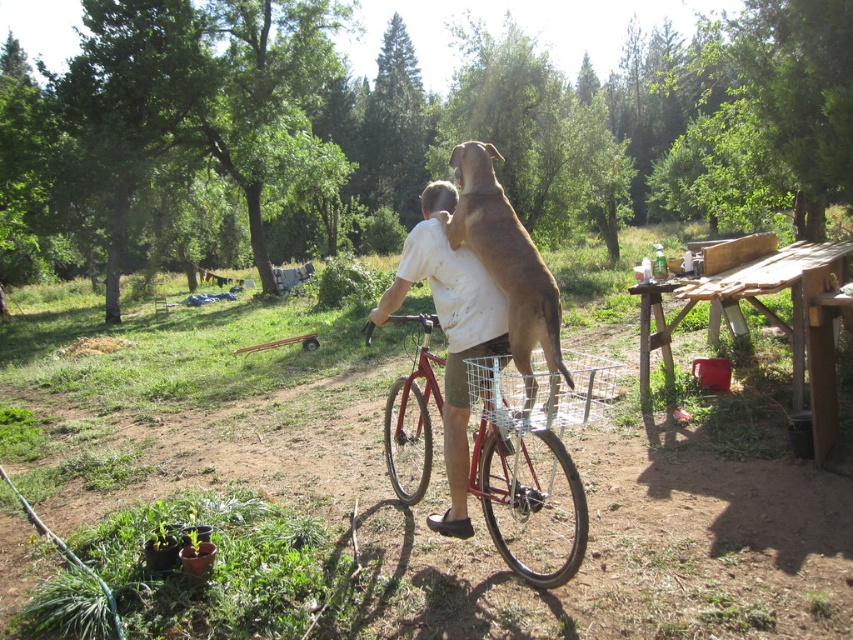
Question: Does wooden picnic table at right appear on the left side of white matte shirt at center?

Choices:
 (A) yes
 (B) no

Answer: (B)

Question: Is the position of white matte shirt at center more distant than that of metallic red bicycle at center?

Choices:
 (A) no
 (B) yes

Answer: (B)

Question: Among these points, which one is nearest to the camera?

Choices:
 (A) (498, 428)
 (B) (515, 506)

Answer: (A)

Question: Does white matte shirt at center appear over brown furry dog at upper center?

Choices:
 (A) no
 (B) yes

Answer: (A)

Question: Which object appears closest to the camera in this image?

Choices:
 (A) wooden picnic table at right
 (B) white matte shirt at center

Answer: (B)

Question: Which point is farther from the camera taking this photo?

Choices:
 (A) (490, 416)
 (B) (440, 412)
 (C) (442, 220)
 (D) (820, 394)

Answer: (D)